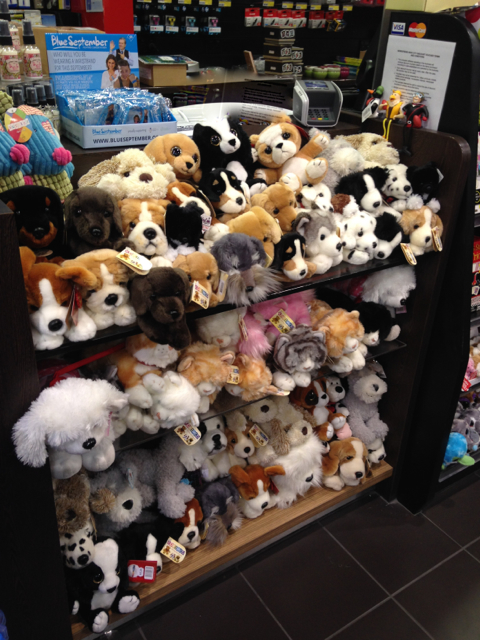
This screenshot has width=480, height=640. In order to click on bottle of candy in this screenshot , I will do `click(9, 64)`, `click(33, 61)`, `click(14, 36)`.